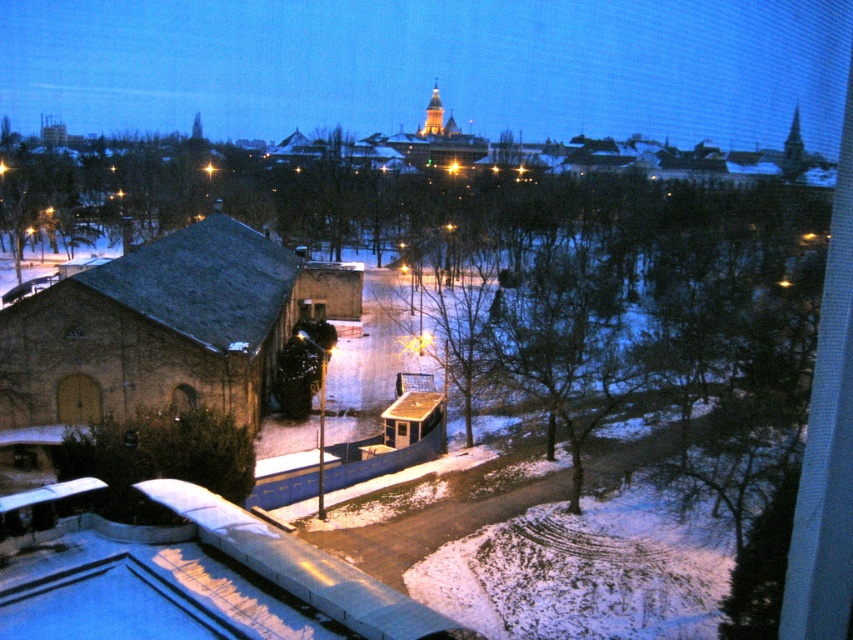
Question: Which point is closer to the camera taking this photo?

Choices:
 (A) (73, 387)
 (B) (403, 429)

Answer: (A)

Question: Does brown stone church at left appear over transparent glass window at center?

Choices:
 (A) no
 (B) yes

Answer: (B)

Question: In this image, where is wooden door at lower left located relative to transparent glass window at center?

Choices:
 (A) right
 (B) left

Answer: (B)

Question: Is transparent glass window at lower left positioned behind transparent glass window at center?

Choices:
 (A) yes
 (B) no

Answer: (B)

Question: Which object appears farthest from the camera in this image?

Choices:
 (A) transparent glass window at lower left
 (B) brown stone church at left
 (C) wooden door at lower left

Answer: (C)

Question: Among these points, which one is nearest to the camera?

Choices:
 (A) (352, 300)
 (B) (399, 422)

Answer: (B)